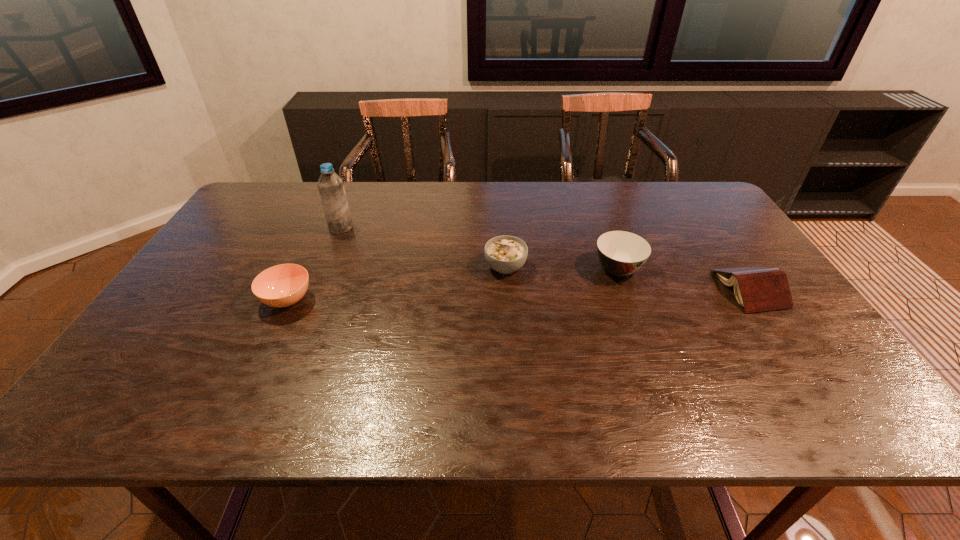
Where is `vacant space that's between the leftmost soup bowl and the book`? This screenshot has height=540, width=960. vacant space that's between the leftmost soup bowl and the book is located at coordinates (518, 294).

You are a GUI agent. You are given a task and a screenshot of the screen. Output one action in this format:
    pyautogui.click(x=<x>, y=<y>)
    Task: Click on the free point between the third object from left to right and the rightmost soup bowl
    This screenshot has width=960, height=540.
    Given the screenshot: What is the action you would take?
    pyautogui.click(x=562, y=268)

Locate an element on the screen. vacant area that lies between the third object from right to left and the second object from right to left is located at coordinates (562, 268).

Where is `unoccupied position between the leftmost soup bowl and the second object from right to left`? unoccupied position between the leftmost soup bowl and the second object from right to left is located at coordinates (453, 284).

Locate an element on the screen. free space between the leftmost soup bowl and the second object from right to left is located at coordinates (453, 284).

Image resolution: width=960 pixels, height=540 pixels. What are the coordinates of `unoccupied area between the third object from right to left and the water bottle` in the screenshot? It's located at (423, 247).

Locate an element on the screen. This screenshot has width=960, height=540. the closest object to the third object from left to right is located at coordinates (621, 253).

Select which object appears as the third closest to the tallest object. Please provide its 2D coordinates. Your answer should be formatted as a tuple, i.e. [(x, y)], where the tuple contains the x and y coordinates of a point satisfying the conditions above.

[(621, 253)]

Find the location of `the second closest soup bowl to the second object from right to left`. the second closest soup bowl to the second object from right to left is located at coordinates (283, 285).

Locate which soup bowl ranks in proximity to the leftmost soup bowl. Please provide its 2D coordinates. Your answer should be formatted as a tuple, i.e. [(x, y)], where the tuple contains the x and y coordinates of a point satisfying the conditions above.

[(506, 254)]